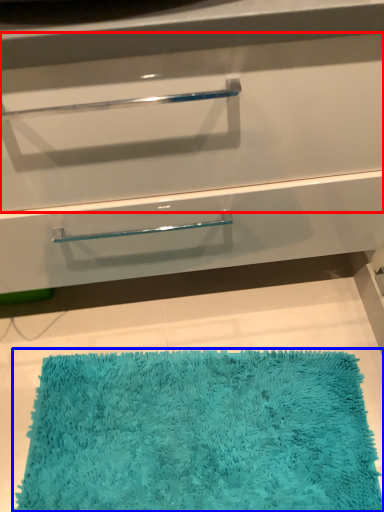
Question: Among these objects, which one is nearest to the camera, drawer (highlighted by a red box) or bath mat (highlighted by a blue box)?

Choices:
 (A) drawer
 (B) bath mat

Answer: (A)